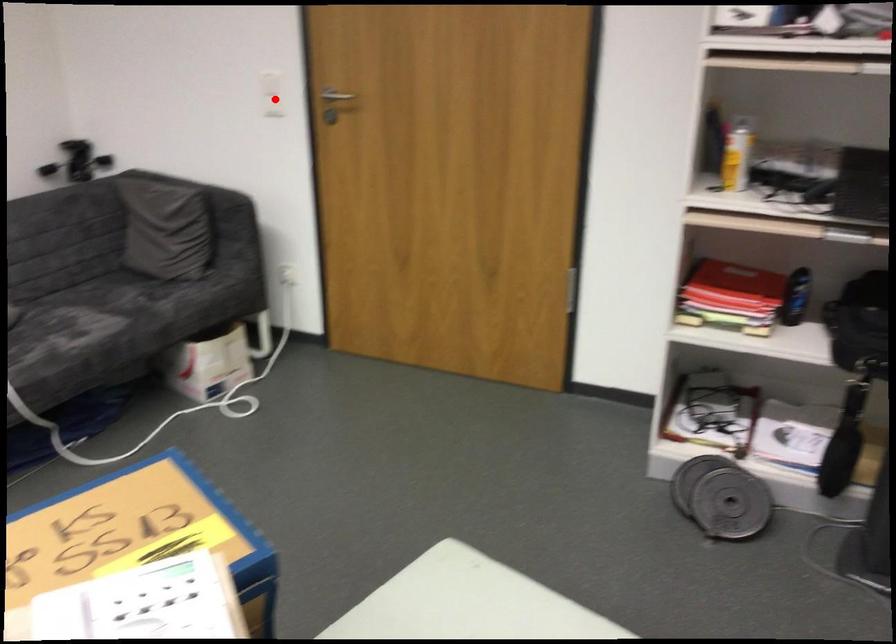
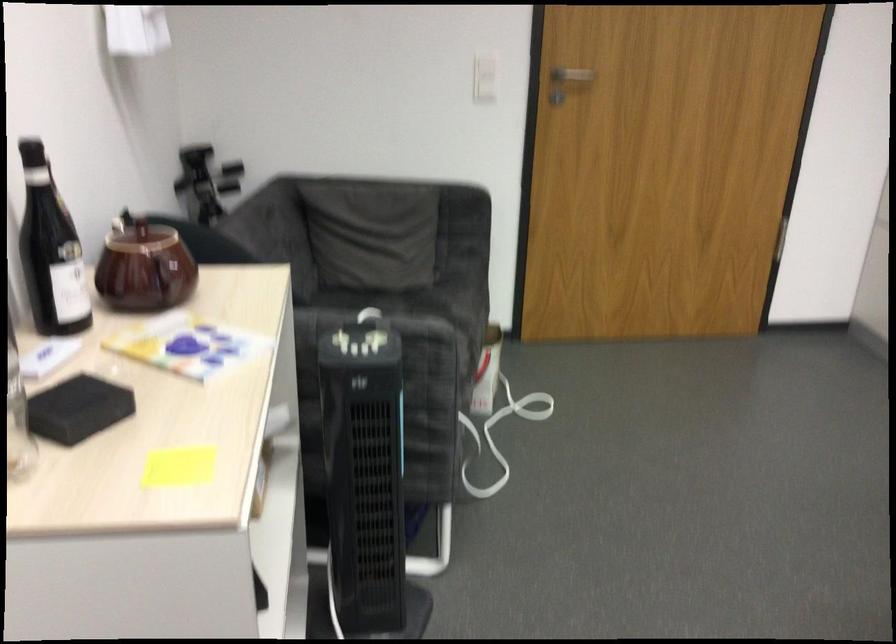
Where in the second image is the point corresponding to the highlighted location from the first image?

(484, 77)